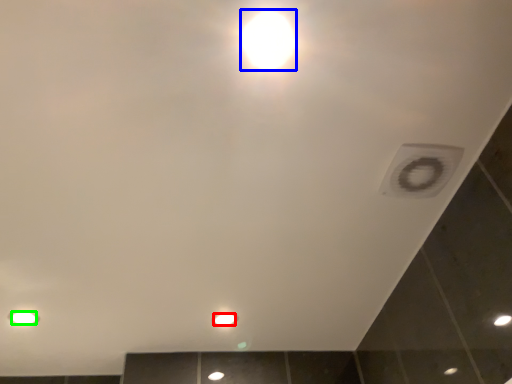
Question: Considering the real-world distances, which object is farthest from light bulb (highlighted by a red box)? light bulb (highlighted by a blue box) or light bulb (highlighted by a green box)?

Choices:
 (A) light bulb
 (B) light bulb

Answer: (A)